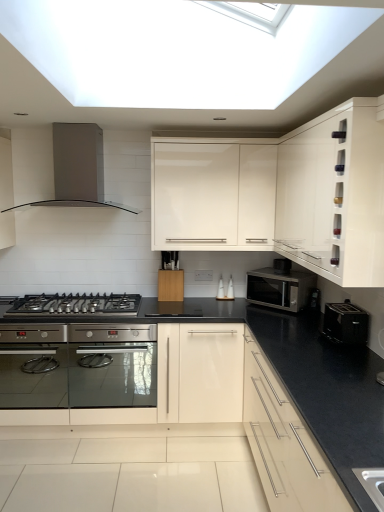
Question: From the image's perspective, is satin silver microwave at center-right under matte white cabinet at lower right, the 3th cabinetry when ordered from top to bottom?

Choices:
 (A) no
 (B) yes

Answer: (A)

Question: Is satin silver microwave at center-right positioned with its back to matte white cabinet at lower right, placed as the first cabinetry when sorted from bottom to top?

Choices:
 (A) no
 (B) yes

Answer: (A)

Question: From the image's perspective, is satin silver microwave at center-right on top of matte white cabinet at lower right, the 3th cabinetry when ordered from top to bottom?

Choices:
 (A) no
 (B) yes

Answer: (B)

Question: From a real-world perspective, is satin silver microwave at center-right positioned over matte white cabinet at lower right, placed as the first cabinetry when sorted from bottom to top, based on gravity?

Choices:
 (A) no
 (B) yes

Answer: (B)

Question: Does satin silver microwave at center-right come behind matte white cabinet at lower right, the 3th cabinetry when ordered from top to bottom?

Choices:
 (A) yes
 (B) no

Answer: (A)

Question: From the image's perspective, is black stainless steel gas stove at lower left above or below satin silver range hood at upper left?

Choices:
 (A) below
 (B) above

Answer: (A)

Question: Is black stainless steel gas stove at lower left wider or thinner than satin silver range hood at upper left?

Choices:
 (A) thin
 (B) wide

Answer: (B)

Question: From a real-world perspective, is black stainless steel gas stove at lower left physically located above or below satin silver range hood at upper left?

Choices:
 (A) below
 (B) above

Answer: (A)

Question: Considering the positions of black stainless steel gas stove at lower left and satin silver range hood at upper left in the image, is black stainless steel gas stove at lower left bigger or smaller than satin silver range hood at upper left?

Choices:
 (A) small
 (B) big

Answer: (A)

Question: Considering the positions of black stainless steel gas stove at lower left and white glossy cabinet at upper right, which is the 2th cabinetry from top to bottom, in the image, is black stainless steel gas stove at lower left bigger or smaller than white glossy cabinet at upper right, which is the 2th cabinetry from top to bottom,?

Choices:
 (A) small
 (B) big

Answer: (A)

Question: From the image's perspective, is black stainless steel gas stove at lower left above or below white glossy cabinet at upper right, positioned as the 2th cabinetry in bottom-to-top order?

Choices:
 (A) below
 (B) above

Answer: (A)

Question: Is black stainless steel gas stove at lower left to the left or to the right of white glossy cabinet at upper right, positioned as the 2th cabinetry in bottom-to-top order, in the image?

Choices:
 (A) right
 (B) left

Answer: (B)

Question: Is black stainless steel gas stove at lower left inside or outside of white glossy cabinet at upper right, positioned as the 2th cabinetry in bottom-to-top order?

Choices:
 (A) outside
 (B) inside

Answer: (A)

Question: In the image, is satin silver range hood at upper left positioned in front of or behind satin silver microwave at center-right?

Choices:
 (A) front
 (B) behind

Answer: (A)

Question: In terms of width, does satin silver range hood at upper left look wider or thinner when compared to satin silver microwave at center-right?

Choices:
 (A) thin
 (B) wide

Answer: (B)